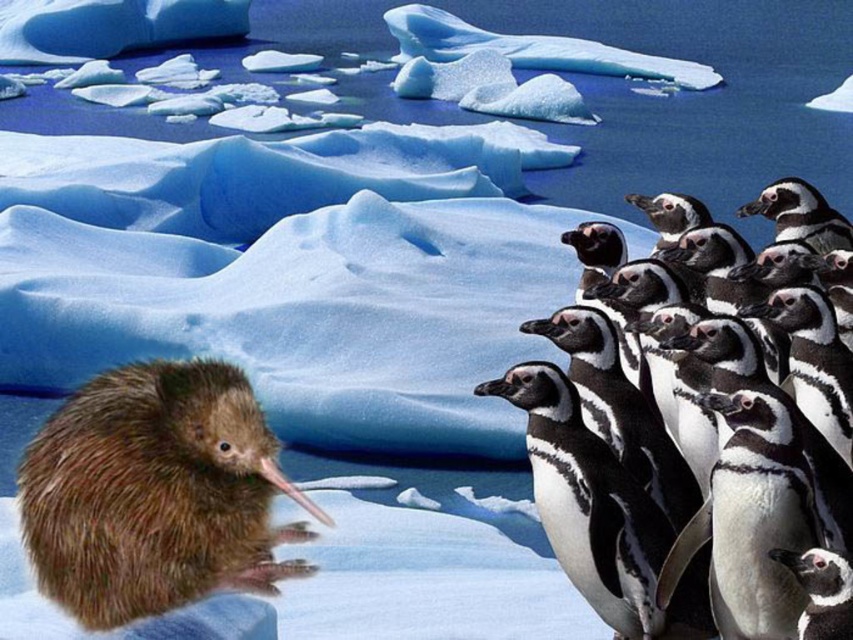
Question: Is the position of brown fuzzy kiwi at lower left more distant than that of black and white feathers at right?

Choices:
 (A) no
 (B) yes

Answer: (A)

Question: Which of the following is the farthest from the observer?

Choices:
 (A) (660, 296)
 (B) (73, 612)

Answer: (A)

Question: Which object appears farthest from the camera in this image?

Choices:
 (A) black and white feathers at right
 (B) brown fuzzy kiwi at lower left

Answer: (A)

Question: Does brown fuzzy kiwi at lower left lie behind black and white feathers at right?

Choices:
 (A) no
 (B) yes

Answer: (A)

Question: Can you confirm if brown fuzzy kiwi at lower left is positioned above black and white feathers at right?

Choices:
 (A) yes
 (B) no

Answer: (B)

Question: Which point appears farthest from the camera in this image?

Choices:
 (A) (190, 531)
 (B) (761, 490)

Answer: (B)